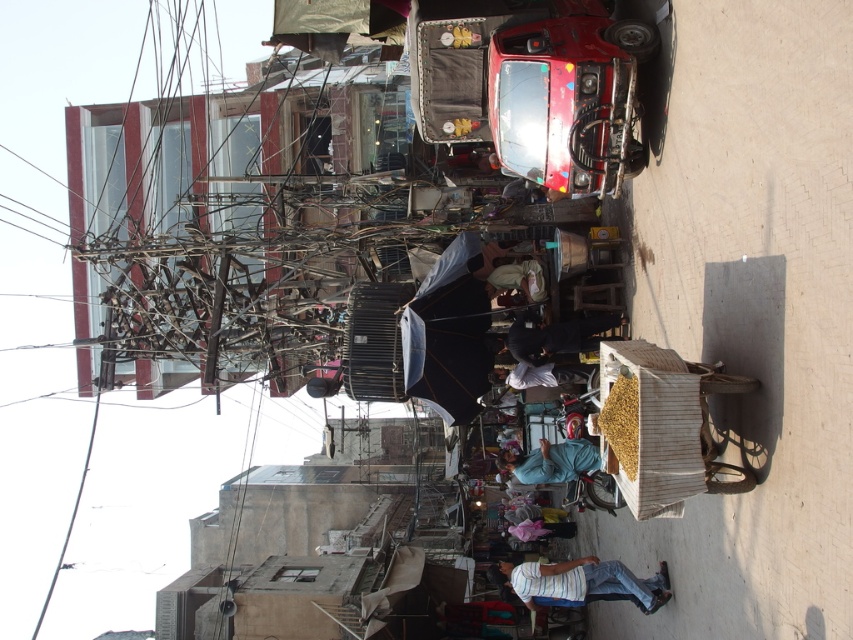
The width and height of the screenshot is (853, 640). What do you see at coordinates (581, 582) in the screenshot? I see `striped cotton shirt at lower center` at bounding box center [581, 582].

Which is in front, point (646, 595) or point (590, 444)?

Point (646, 595) is more forward.

What do you see at coordinates (581, 582) in the screenshot?
I see `striped cotton shirt at lower center` at bounding box center [581, 582].

Where is `striped cotton shirt at lower center`? The height and width of the screenshot is (640, 853). striped cotton shirt at lower center is located at coordinates (581, 582).

Who is more forward, (573, 337) or (558, 480)?

Point (573, 337) is more forward.

Between point (611, 337) and point (560, 468), which one is positioned behind?

Positioned behind is point (560, 468).

This screenshot has width=853, height=640. What are the coordinates of `black fabric at center` in the screenshot? It's located at (558, 337).

What are the coordinates of `striped cotton shirt at lower center` in the screenshot? It's located at (581, 582).

Is point (645, 609) behind point (579, 337)?

No, it is not.

Locate an element on the screen. striped cotton shirt at lower center is located at coordinates (581, 582).